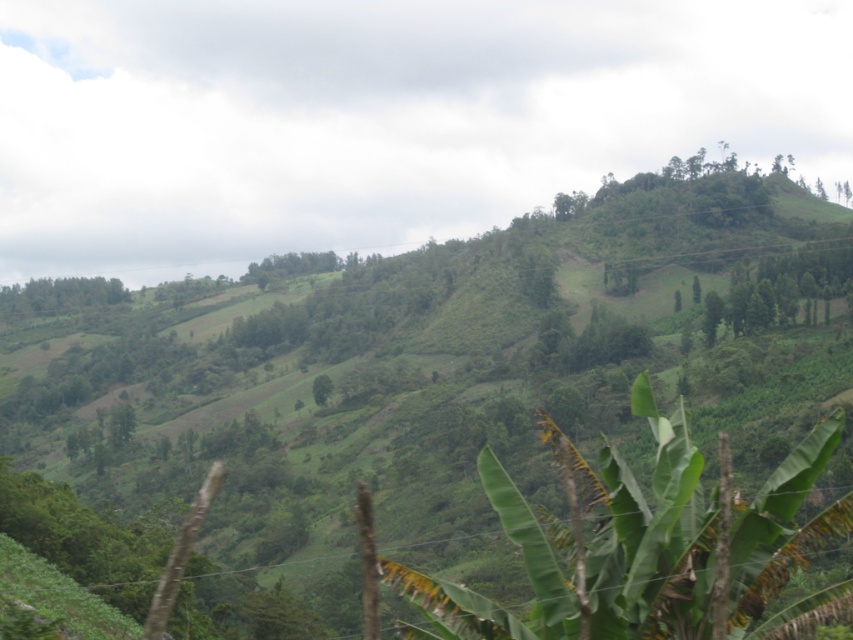
Does green leafy banana tree at center appear on the left side of green leafy trees at left?

Incorrect, green leafy banana tree at center is not on the left side of green leafy trees at left.

Consider the image. Is green leafy banana tree at center positioned in front of green leafy trees at left?

Yes, green leafy banana tree at center is in front of green leafy trees at left.

Between point (639, 557) and point (33, 307), which one is positioned in front?

Positioned in front is point (639, 557).

Locate an element on the screen. The image size is (853, 640). green leafy banana tree at center is located at coordinates (592, 548).